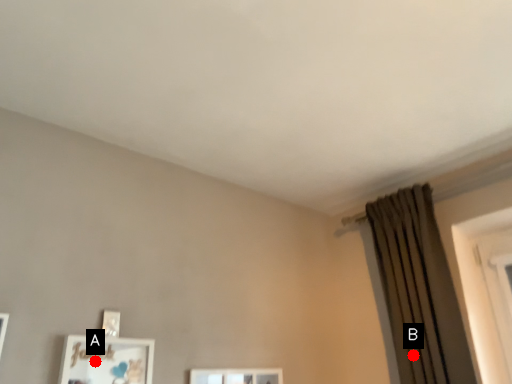
Question: Two points are circled on the image, labeled by A and B beside each circle. Which of the following is the closest to the observer?

Choices:
 (A) A is closer
 (B) B is closer

Answer: (A)